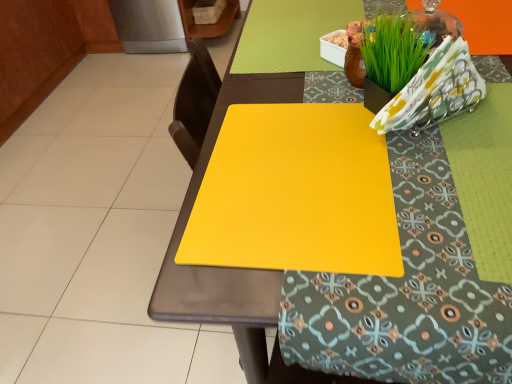
Question: Looking at their shapes, would you say yellow matte placemat at center is wider or thinner than yellow matte cutting board at center?

Choices:
 (A) wide
 (B) thin

Answer: (A)

Question: Considering their positions, is yellow matte placemat at center located in front of or behind yellow matte cutting board at center?

Choices:
 (A) behind
 (B) front

Answer: (B)

Question: From the image's perspective, is yellow matte placemat at center located above or below yellow matte cutting board at center?

Choices:
 (A) below
 (B) above

Answer: (A)

Question: Considering the positions of yellow matte cutting board at center and yellow matte placemat at center in the image, is yellow matte cutting board at center taller or shorter than yellow matte placemat at center?

Choices:
 (A) short
 (B) tall

Answer: (A)

Question: Is yellow matte cutting board at center bigger or smaller than yellow matte placemat at center?

Choices:
 (A) small
 (B) big

Answer: (A)

Question: Visually, is yellow matte cutting board at center positioned to the left or to the right of yellow matte placemat at center?

Choices:
 (A) right
 (B) left

Answer: (B)

Question: Is point (356, 246) closer or farther from the camera than point (273, 86)?

Choices:
 (A) farther
 (B) closer

Answer: (B)